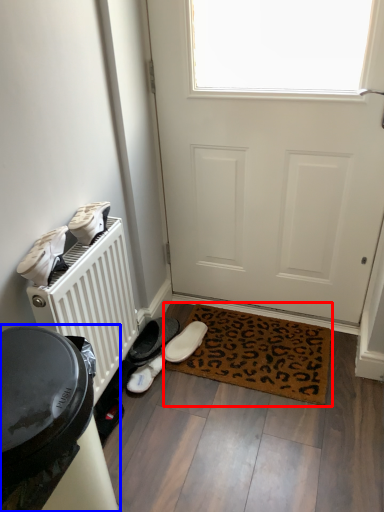
Question: Which object appears farthest to the camera in this image, mat (highlighted by a red box) or appliance (highlighted by a blue box)?

Choices:
 (A) mat
 (B) appliance

Answer: (A)